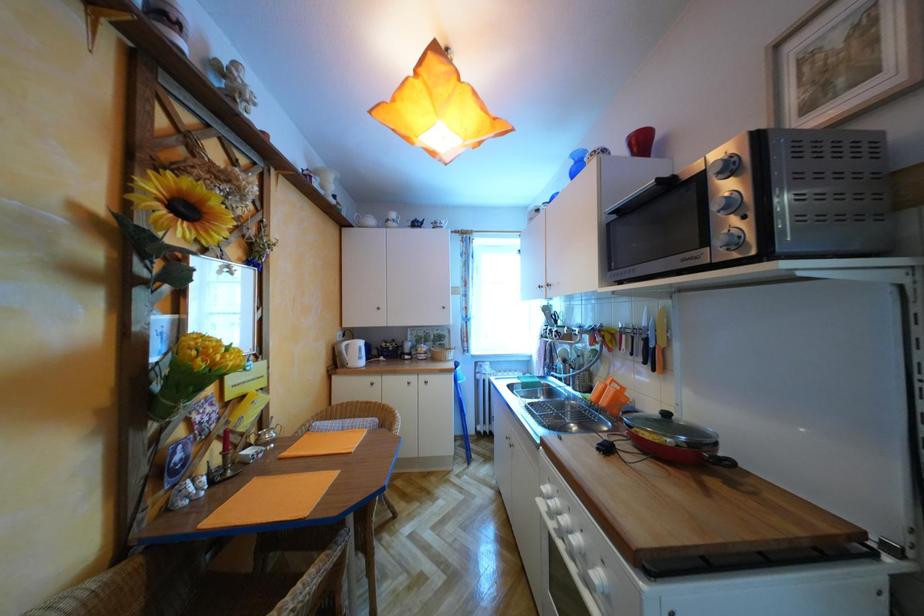
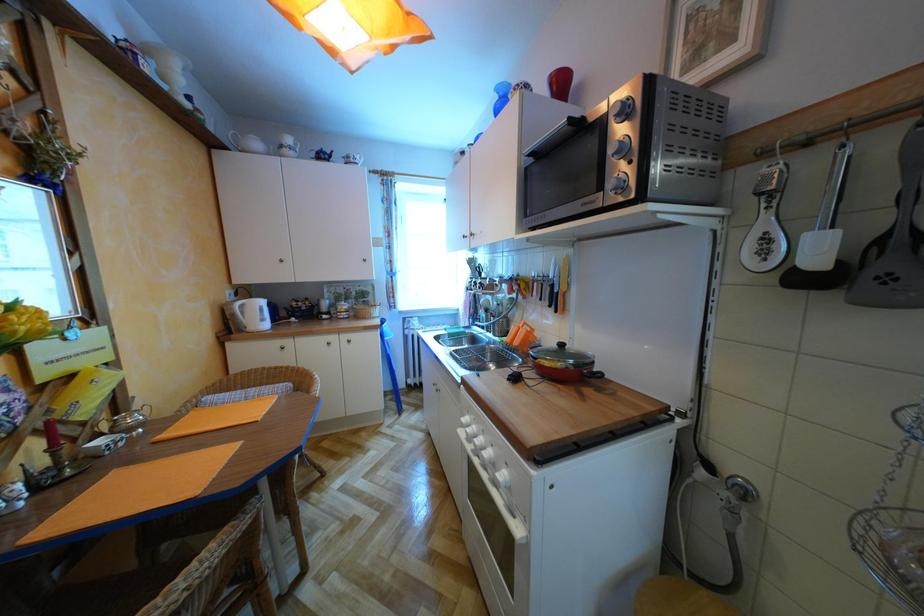
Question: The camera is either moving clockwise (left) or counter-clockwise (right) around the object. The first image is from the beginning of the video and the second image is from the end. Is the camera moving left or right when shooting the video?

Choices:
 (A) Left
 (B) Right

Answer: (A)